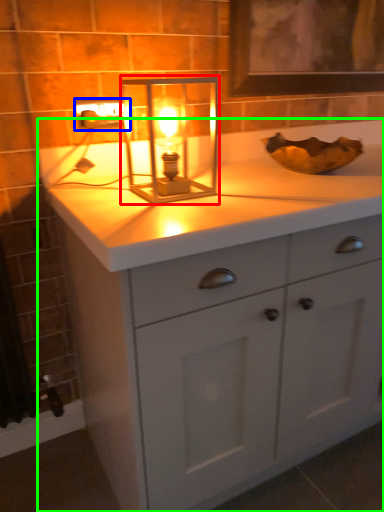
Question: Which object is the closest to the candle holder (highlighted by a red box)? Choose among these: electric outlet (highlighted by a blue box) or bathroom cabinet (highlighted by a green box).

Choices:
 (A) electric outlet
 (B) bathroom cabinet

Answer: (A)